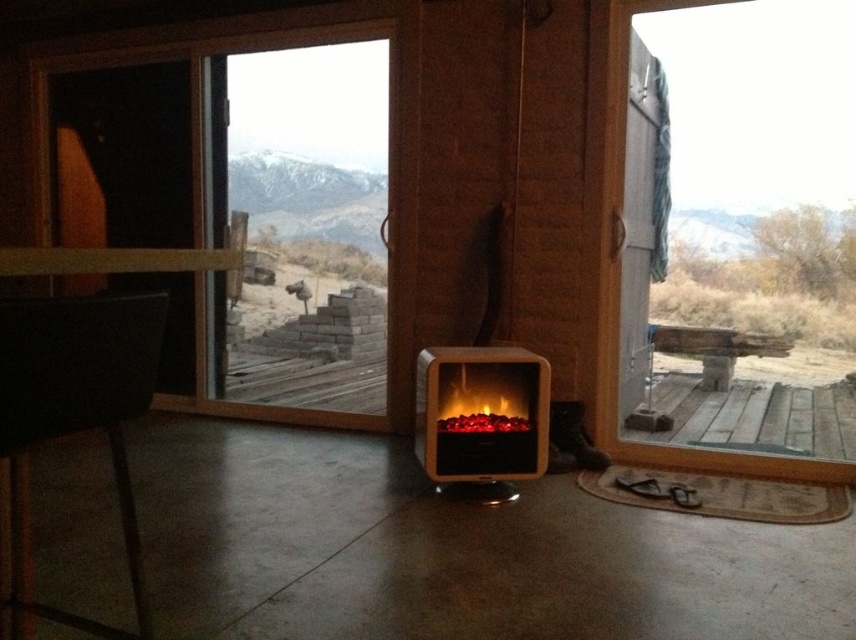
Find the location of a particular element. This screenshot has height=640, width=856. wooden deck at center is located at coordinates (449, 552).

Which of these two, wooden deck at center or wooden electric fireplace at center, stands taller?

With more height is wooden electric fireplace at center.

Is point (424, 508) more distant than point (479, 372)?

No, it is in front of (479, 372).

Find the location of a particular element. Image resolution: width=856 pixels, height=640 pixels. wooden deck at center is located at coordinates (449, 552).

Is point (473, 394) farther from viewer compared to point (835, 387)?

No, it is in front of (835, 387).

Between point (474, 412) and point (783, 396), which one is positioned behind?

Positioned behind is point (783, 396).

Identify the location of wooden electric fireplace at center. This screenshot has height=640, width=856. (480, 419).

Can you confirm if wooden deck at center is positioned to the right of weathered wood deck at lower right?

No, wooden deck at center is not to the right of weathered wood deck at lower right.

This screenshot has width=856, height=640. Describe the element at coordinates (449, 552) in the screenshot. I see `wooden deck at center` at that location.

Between point (816, 605) and point (789, 400), which one is positioned behind?

The point (789, 400) is more distant.

Locate an element on the screen. wooden deck at center is located at coordinates (449, 552).